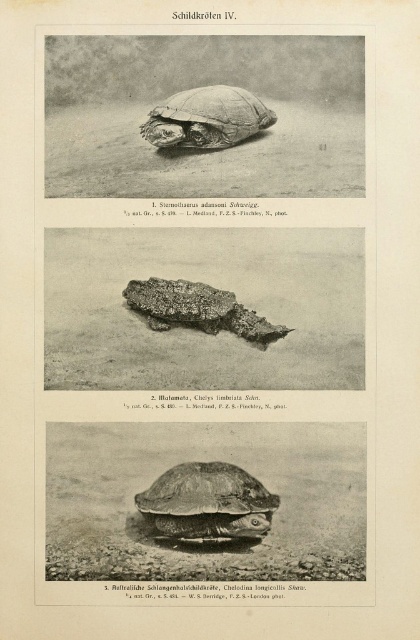
Looking at this image, is rough textured tortoise at center behind rough textured shell at center?

No.

Which is more to the left, rough textured tortoise at center or rough textured shell at center?

From the viewer's perspective, rough textured shell at center appears more on the left side.

Does point (265, 125) come closer to viewer compared to point (130, 294)?

That is False.

Locate an element on the screen. rough textured tortoise at center is located at coordinates (207, 118).

Between brown textured shell at center and rough textured tortoise at center, which one has less height?

Standing shorter between the two is rough textured tortoise at center.

Between point (259, 524) and point (220, 141), which one is positioned behind?

Positioned behind is point (220, 141).

The image size is (420, 640). In order to click on brown textured shell at center in this screenshot , I will do `click(207, 502)`.

The image size is (420, 640). I want to click on brown textured shell at center, so point(207,502).

Is brown textured shell at center smaller than rough textured shell at center?

No.

Does brown textured shell at center appear under rough textured shell at center?

Yes, brown textured shell at center is below rough textured shell at center.

Who is more distant from viewer, (223, 464) or (231, 292)?

Point (231, 292)

This screenshot has width=420, height=640. I want to click on brown textured shell at center, so click(207, 502).